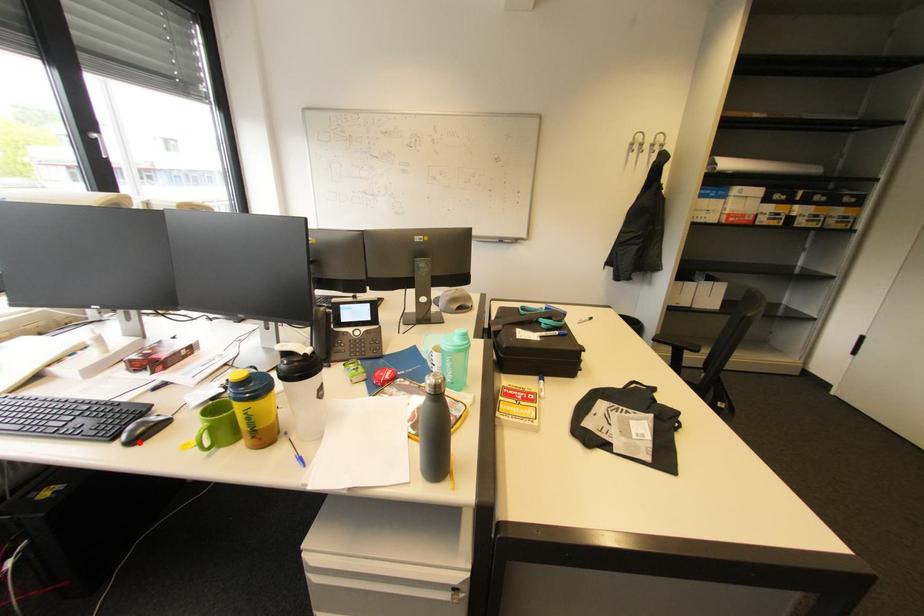
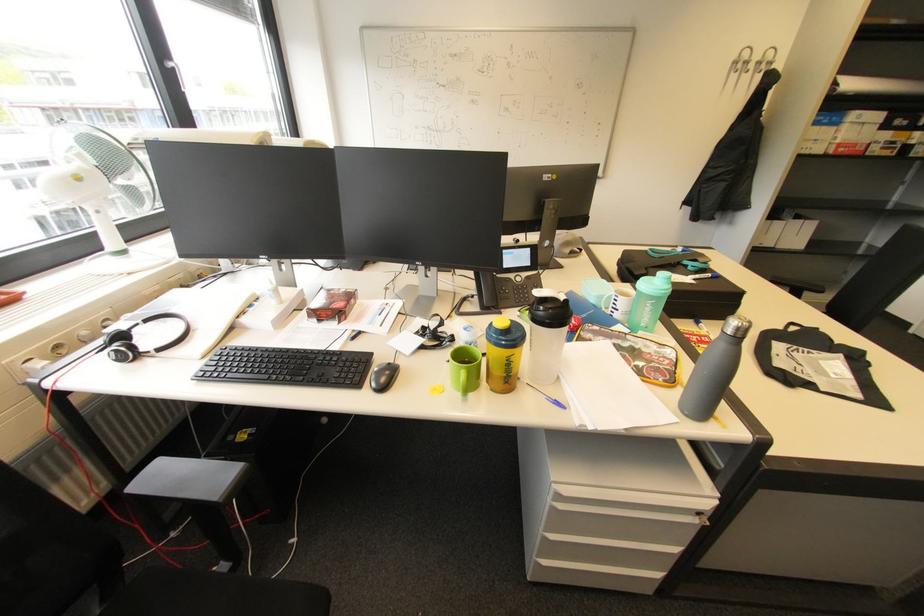
In the second image, find the point that corresponds to the highlighted location in the first image.

(387, 389)